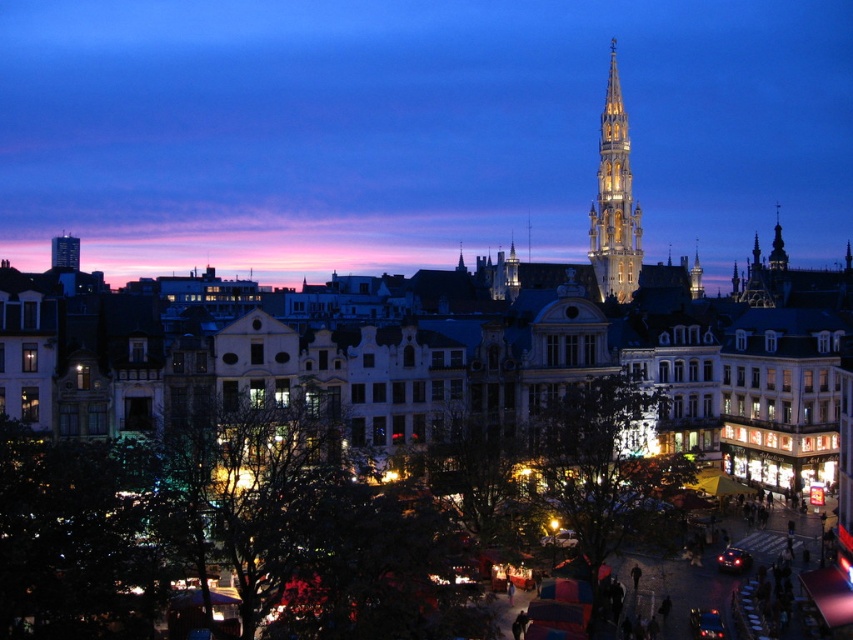
Question: Observing the image, what is the correct spatial positioning of matte stone tower at upper center in reference to illuminated stone spire at upper right?

Choices:
 (A) above
 (B) below

Answer: (A)

Question: Which point is closer to the camera taking this photo?

Choices:
 (A) (596, 280)
 (B) (254, 108)

Answer: (A)

Question: Can you confirm if matte stone tower at upper center is bigger than illuminated stone spire at upper right?

Choices:
 (A) no
 (B) yes

Answer: (B)

Question: Observing the image, what is the correct spatial positioning of matte stone tower at upper center in reference to illuminated stone spire at upper right?

Choices:
 (A) right
 (B) left

Answer: (B)